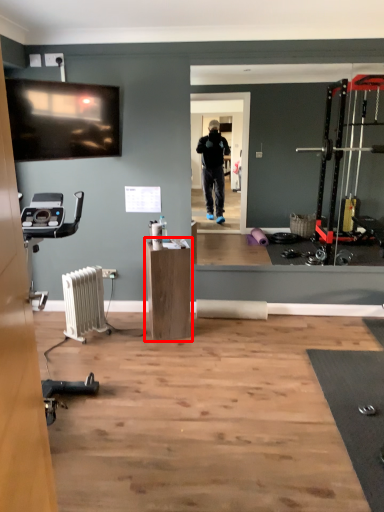
Question: Considering the relative positions of furniture (annotated by the red box) and radiator in the image provided, where is furniture (annotated by the red box) located with respect to the staircase?

Choices:
 (A) right
 (B) left

Answer: (A)